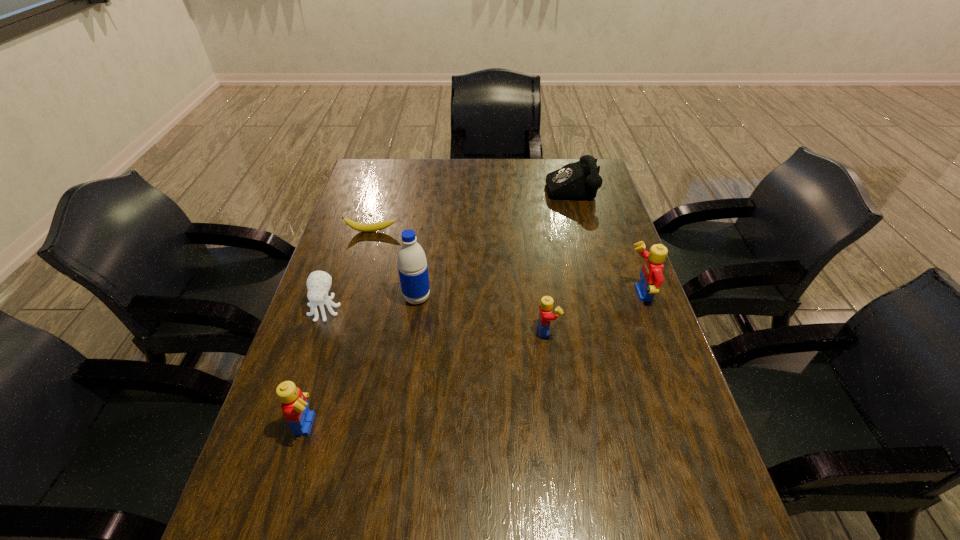
Find the location of a particular element. The height and width of the screenshot is (540, 960). vacant region at the near edge is located at coordinates (480, 495).

The height and width of the screenshot is (540, 960). I want to click on vacant space at the left edge, so click(x=283, y=423).

The image size is (960, 540). What are the coordinates of `vacant space at the right edge` in the screenshot? It's located at (646, 351).

I want to click on free space at the near left corner of the desktop, so click(x=312, y=484).

Locate an element on the screen. This screenshot has width=960, height=540. free space at the near right corner is located at coordinates (690, 472).

Where is `free spot between the rightmost Lego and the fifth shortest object`? Image resolution: width=960 pixels, height=540 pixels. free spot between the rightmost Lego and the fifth shortest object is located at coordinates (474, 359).

Locate an element on the screen. Image resolution: width=960 pixels, height=540 pixels. free space between the octopus and the fourth object from right to left is located at coordinates (371, 303).

In order to click on vacant space in between the octopus and the second farthest object in this screenshot , I will do `click(348, 270)`.

Where is `vacant space in between the fourth object from left to right and the farthest Lego`? The image size is (960, 540). vacant space in between the fourth object from left to right and the farthest Lego is located at coordinates (528, 296).

In order to click on vacant region between the octopus and the tallest object in this screenshot , I will do `click(371, 303)`.